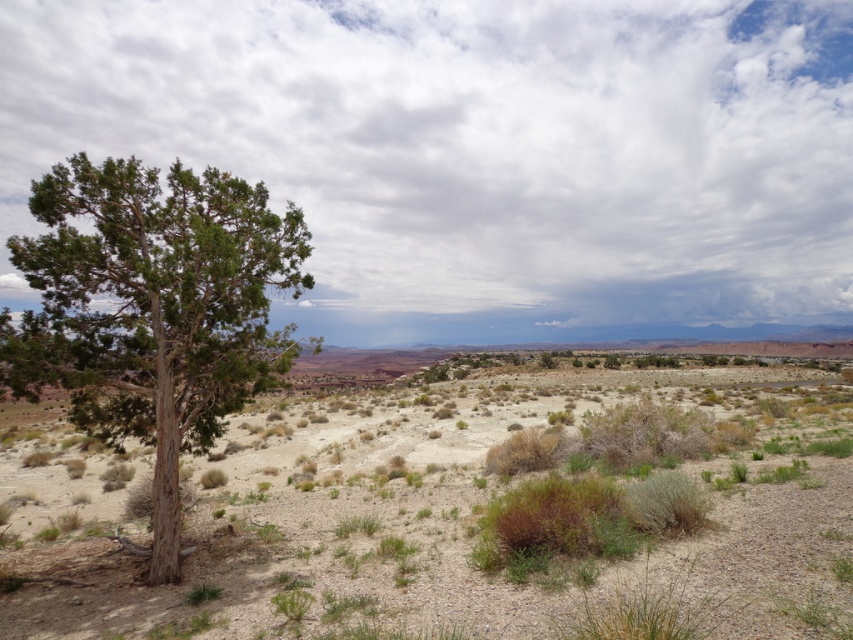
You are a hiker who wants to take a photo of the green shrubbery at center and the green textured tree at left. Which object should you focus on first if you want to capture both in a single frame without moving your camera?

The green shrubbery at center is positioned under green textured tree at left, so you should focus on the green textured tree at left first to ensure both are in focus as the shrubbery is closer to the camera.

You are a desert explorer trying to navigate between the green shrubbery at center and the green textured tree at left. Which direction should you move to go from the tree to the shrubbery?

To move from the green textured tree at left to the green shrubbery at center, you should move to the right since the green shrubbery at center is located to the right of the green textured tree at left.